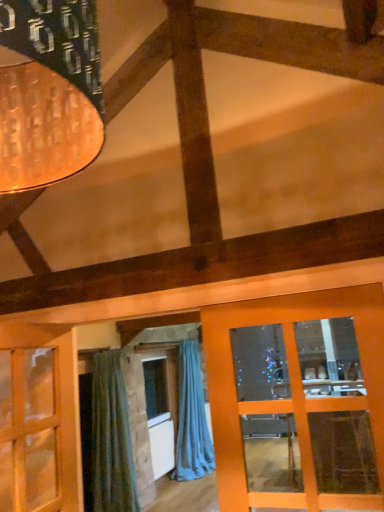
Question: Which direction should I rotate to face blue fabric curtain at center, marked as the 2th curtain in a front-to-back arrangement, — up or down?

Choices:
 (A) down
 (B) up

Answer: (A)

Question: Could you tell me if green fabric curtain at lower left, positioned as the 2th curtain in right-to-left order, is turned towards blue fabric curtain at center, placed as the first curtain when sorted from right to left?

Choices:
 (A) yes
 (B) no

Answer: (B)

Question: Could blue fabric curtain at center, positioned as the first curtain in back-to-front order, be considered to be inside green fabric curtain at lower left, placed as the 2th curtain when sorted from back to front?

Choices:
 (A) no
 (B) yes

Answer: (A)

Question: From a real-world perspective, does green fabric curtain at lower left, placed as the 2th curtain when sorted from back to front, stand above blue fabric curtain at center, marked as the 2th curtain in a front-to-back arrangement?

Choices:
 (A) yes
 (B) no

Answer: (A)

Question: Is green fabric curtain at lower left, which is counted as the 1th curtain, starting from the front, further to the viewer compared to blue fabric curtain at center, marked as the 2th curtain in a front-to-back arrangement?

Choices:
 (A) yes
 (B) no

Answer: (B)

Question: Is green fabric curtain at lower left, which is counted as the 1th curtain, starting from the front, to the right of blue fabric curtain at center, marked as the 2th curtain in a front-to-back arrangement, from the viewer's perspective?

Choices:
 (A) no
 (B) yes

Answer: (A)

Question: Considering the relative sizes of green fabric curtain at lower left, which is counted as the 1th curtain, starting from the front, and blue fabric curtain at center, placed as the first curtain when sorted from right to left, in the image provided, is green fabric curtain at lower left, which is counted as the 1th curtain, starting from the front, bigger than blue fabric curtain at center, placed as the first curtain when sorted from right to left,?

Choices:
 (A) yes
 (B) no

Answer: (B)

Question: Is blue fabric curtain at center, placed as the first curtain when sorted from right to left, wider than green fabric curtain at lower left, placed as the 2th curtain when sorted from back to front?

Choices:
 (A) yes
 (B) no

Answer: (A)

Question: Considering the relative sizes of blue fabric curtain at center, marked as the 2th curtain in a front-to-back arrangement, and green fabric curtain at lower left, positioned as the 2th curtain in right-to-left order, in the image provided, is blue fabric curtain at center, marked as the 2th curtain in a front-to-back arrangement, thinner than green fabric curtain at lower left, positioned as the 2th curtain in right-to-left order,?

Choices:
 (A) yes
 (B) no

Answer: (B)

Question: Considering the relative sizes of blue fabric curtain at center, positioned as the first curtain in back-to-front order, and green fabric curtain at lower left, placed as the 2th curtain when sorted from back to front, in the image provided, is blue fabric curtain at center, positioned as the first curtain in back-to-front order, smaller than green fabric curtain at lower left, placed as the 2th curtain when sorted from back to front,?

Choices:
 (A) yes
 (B) no

Answer: (B)

Question: From a real-world perspective, is blue fabric curtain at center, positioned as the 2th curtain in left-to-right order, on top of green fabric curtain at lower left, placed as the 2th curtain when sorted from back to front?

Choices:
 (A) yes
 (B) no

Answer: (B)

Question: Is blue fabric curtain at center, positioned as the first curtain in back-to-front order, positioned with its back to green fabric curtain at lower left, placed as the 2th curtain when sorted from back to front?

Choices:
 (A) no
 (B) yes

Answer: (A)

Question: Considering the relative positions of blue fabric curtain at center, positioned as the first curtain in back-to-front order, and green fabric curtain at lower left, which is counted as the 1th curtain, starting from the front, in the image provided, is blue fabric curtain at center, positioned as the first curtain in back-to-front order, to the left of green fabric curtain at lower left, which is counted as the 1th curtain, starting from the front, from the viewer's perspective?

Choices:
 (A) yes
 (B) no

Answer: (B)

Question: Relative to blue fabric curtain at center, placed as the first curtain when sorted from right to left, is green fabric curtain at lower left, marked as the first curtain in a left-to-right arrangement, in front or behind?

Choices:
 (A) front
 (B) behind

Answer: (A)